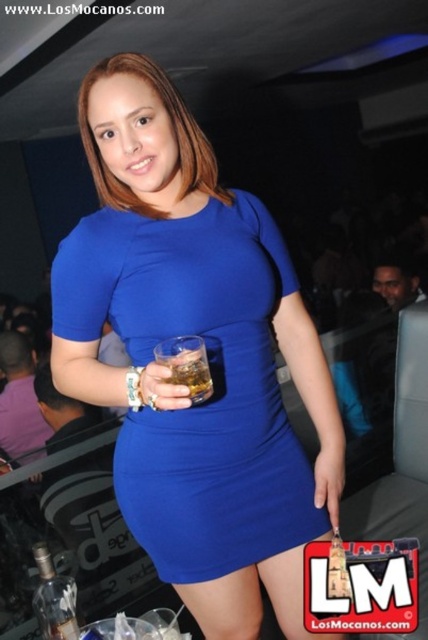
What are the coordinates of the royal blue jersey dress at center?

The royal blue jersey dress at center is located at point [211,378].

You are a photographer at the event and want to capture the woman in the royal blue jersey dress at center without any obstructions. Since the translucent glass at center is in the frame, will you need to adjust your angle to avoid it?

Yes, you need to adjust your angle because the translucent glass at center is positioned above the royal blue jersey dress at center, meaning it would block part of the dress if not repositioned.